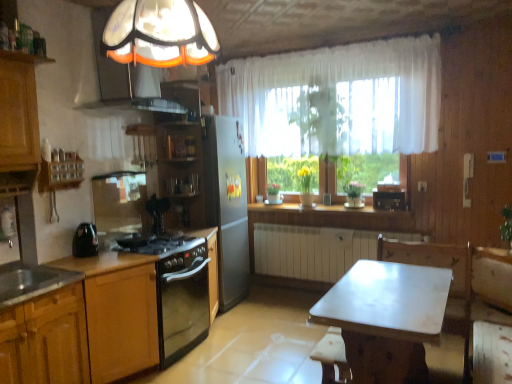
Question: From their relative heights in the image, would you say matte glass exhaust hood at upper left is taller or shorter than black glossy kettle at left?

Choices:
 (A) tall
 (B) short

Answer: (A)

Question: Looking at their shapes, would you say matte glass exhaust hood at upper left is wider or thinner than black glossy kettle at left?

Choices:
 (A) wide
 (B) thin

Answer: (A)

Question: Which object is positioned closest to the matte glass exhaust hood at upper left?

Choices:
 (A) white sheer curtain at upper center
 (B) wooden cabinet at lower left, the first cabinetry in the left-to-right sequence
 (C) wooden table at center
 (D) black glass gas stove at lower left
 (E) wooden cabinet at lower left, positioned as the 2th cabinetry in left-to-right order

Answer: (D)

Question: Considering the real-world distances, which object is closest to the black glass gas stove at lower left?

Choices:
 (A) matte glass exhaust hood at upper left
 (B) translucent glass lampshade at upper center
 (C) white sheer curtain at upper center
 (D) wooden bar stool at lower center
 (E) black glossy kettle at left

Answer: (E)